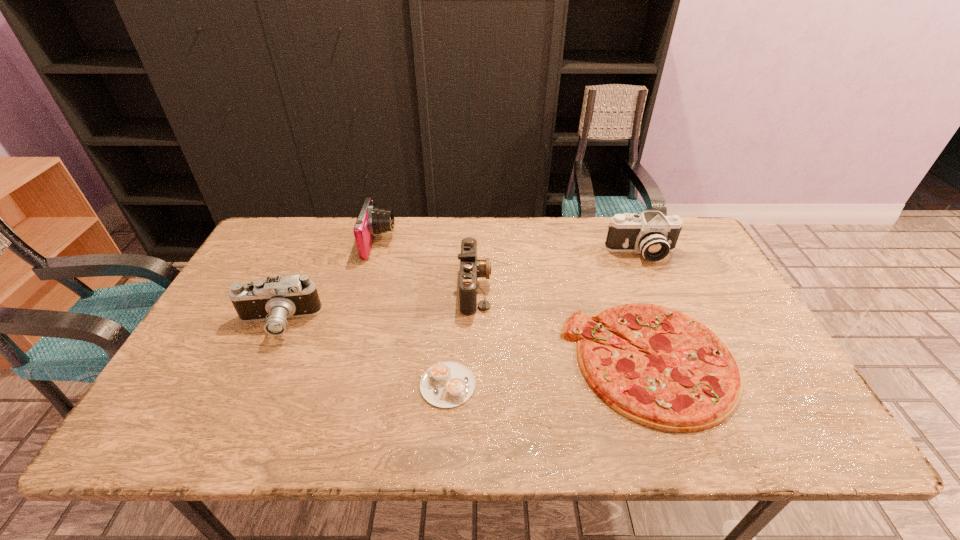
Image resolution: width=960 pixels, height=540 pixels. Identify the location of vacant space in between the second camera from right to left and the shortest object. (461, 336).

This screenshot has height=540, width=960. Find the location of `free space that is in between the shortest object and the leftmost camera`. free space that is in between the shortest object and the leftmost camera is located at coordinates (363, 354).

Choose which object is the fourth nearest neighbor to the second camera from right to left. Please provide its 2D coordinates. Your answer should be formatted as a tuple, i.e. [(x, y)], where the tuple contains the x and y coordinates of a point satisfying the conditions above.

[(652, 234)]

This screenshot has height=540, width=960. Identify the location of object identified as the third closest to the leftmost camera. [471, 268].

The height and width of the screenshot is (540, 960). Find the location of `the third closest camera to the third camera from right to left`. the third closest camera to the third camera from right to left is located at coordinates (652, 234).

This screenshot has height=540, width=960. Identify the location of camera identified as the fourth closest to the fifth tallest object. (274, 300).

Identify the location of vacant area in the image that satisfies the following two spatial constraints: 1. on the back side of the pizza; 2. on the left side of the cappuccino. This screenshot has width=960, height=540. (449, 361).

At what (x,y) coordinates should I click in order to perform the action: click on vacant space that satisfies the following two spatial constraints: 1. at the lens of the leftmost object; 2. on the right side of the pizza. Please return your answer as a coordinate pair (x, y). The image size is (960, 540). Looking at the image, I should click on (260, 361).

The image size is (960, 540). I want to click on free space in the image that satisfies the following two spatial constraints: 1. at the lens of the second shortest object; 2. on the left side of the leftmost object, so click(260, 361).

Locate an element on the screen. The width and height of the screenshot is (960, 540). free space that satisfies the following two spatial constraints: 1. on the front-facing side of the second camera from right to left; 2. at the lens of the leftmost camera is located at coordinates (474, 323).